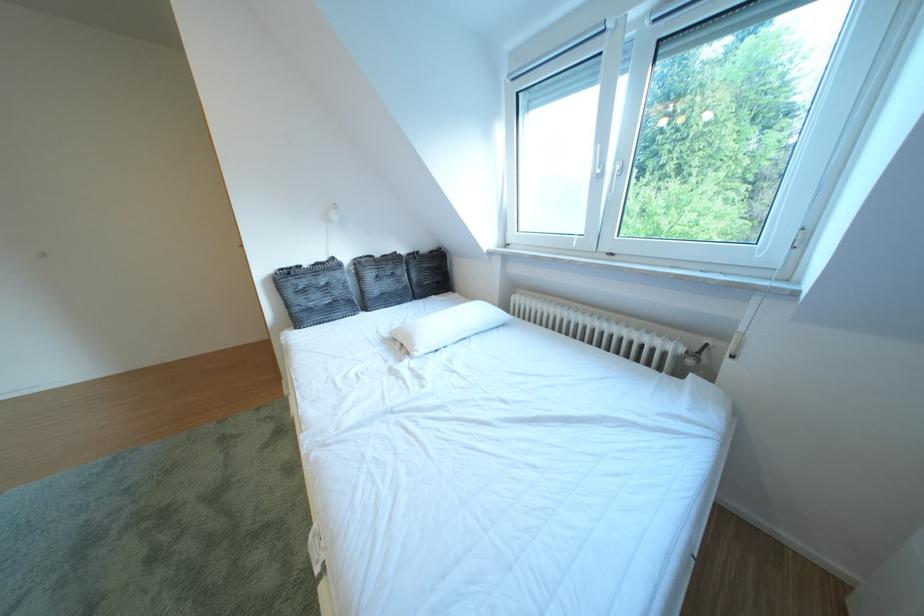
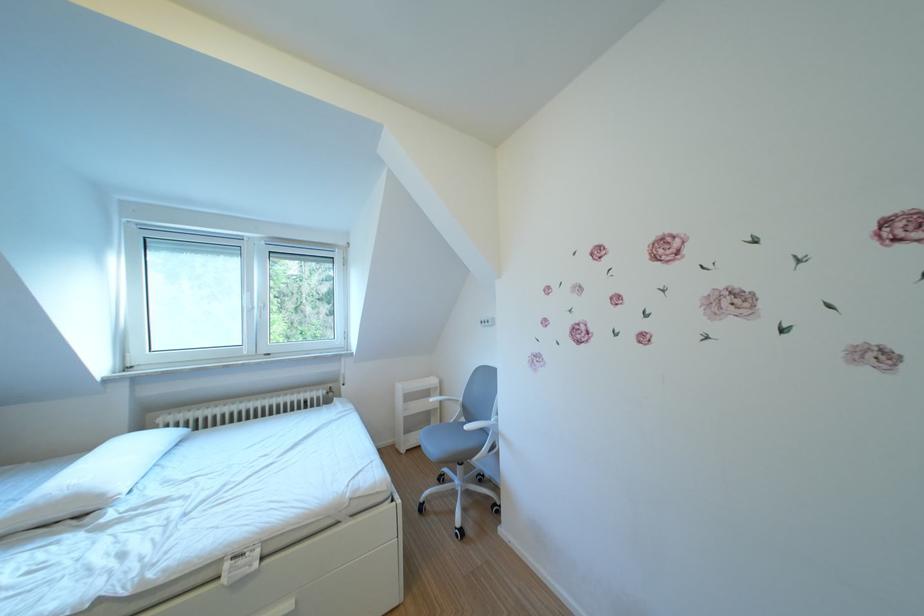
The point at (427, 350) is marked in the first image. Where is the corresponding point in the second image?

(115, 501)